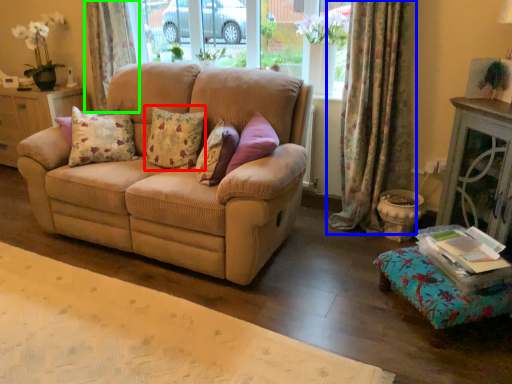
Question: Considering the real-world distances, which object is farthest from pillow (highlighted by a red box)? curtain (highlighted by a blue box) or curtain (highlighted by a green box)?

Choices:
 (A) curtain
 (B) curtain

Answer: (B)